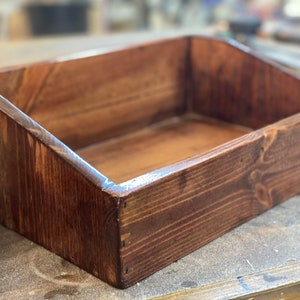
At what (x,y) coordinates should I click in order to perform the action: click on wood trim of table top. Please return your answer as a coordinate pair (x, y). The height and width of the screenshot is (300, 300). Looking at the image, I should click on (228, 291).